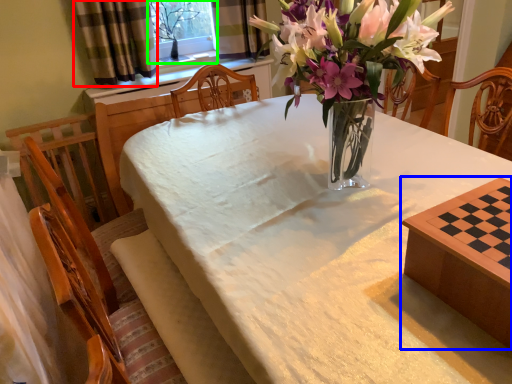
Question: Considering the real-world distances, which object is farthest from curtain (highlighted by a red box)? table (highlighted by a blue box) or window screen (highlighted by a green box)?

Choices:
 (A) table
 (B) window screen

Answer: (A)